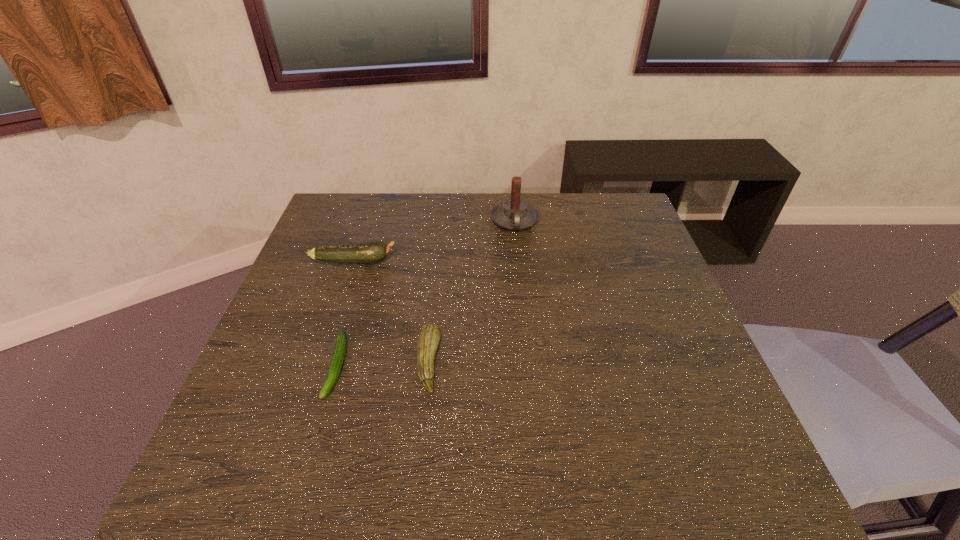
Find the location of a particular element. This screenshot has width=960, height=540. the rightmost object is located at coordinates (514, 214).

Find the location of a particular element. This screenshot has height=540, width=960. the farthest object is located at coordinates (514, 214).

Where is `the third nearest object`? the third nearest object is located at coordinates (375, 251).

Locate an element on the screen. The image size is (960, 540). the tallest zucchini is located at coordinates (375, 251).

You are a GUI agent. You are given a task and a screenshot of the screen. Output one action in this format:
    pyautogui.click(x=<x>, y=<y>)
    Task: Click on the third object from left to right
    Image resolution: width=960 pixels, height=540 pixels.
    Given the screenshot: What is the action you would take?
    pyautogui.click(x=428, y=339)

Where is `the second shortest zucchini`? The image size is (960, 540). the second shortest zucchini is located at coordinates (428, 339).

At what (x,y) coordinates should I click in order to perform the action: click on the shortest zucchini. Please return your answer as a coordinate pair (x, y). Image resolution: width=960 pixels, height=540 pixels. Looking at the image, I should click on (341, 342).

Where is `vacant area situated 0.380m on the side of the candle with the handle loop`? Image resolution: width=960 pixels, height=540 pixels. vacant area situated 0.380m on the side of the candle with the handle loop is located at coordinates (526, 335).

Where is `vacant area situated at the blossom end of the third shortest object`? The height and width of the screenshot is (540, 960). vacant area situated at the blossom end of the third shortest object is located at coordinates [x=421, y=261].

At what (x,y) coordinates should I click in order to perform the action: click on free location located at the stem end of the third tallest object. Please return your answer as a coordinate pair (x, y). Looking at the image, I should click on (521, 362).